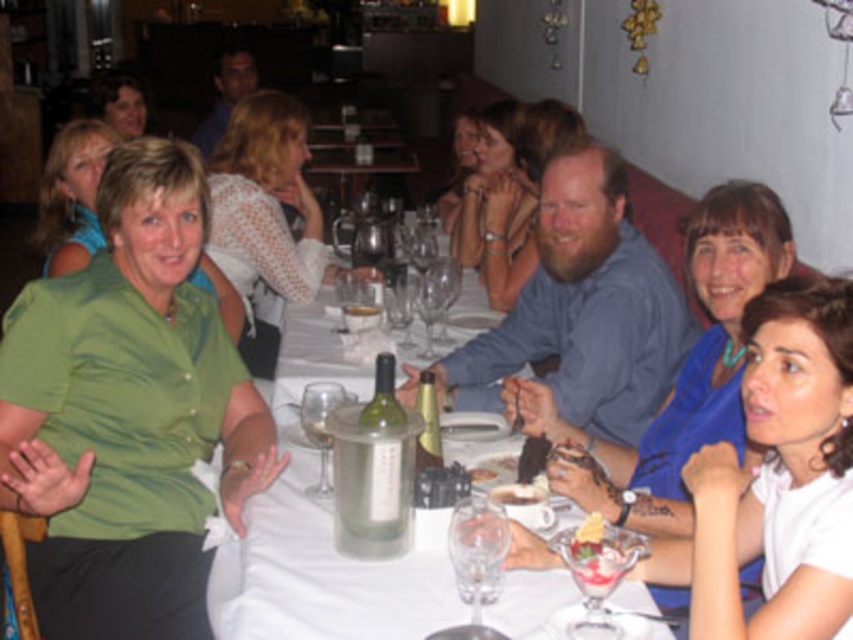
Question: Can you confirm if transparent glass at center is positioned below matte black hair at upper left?

Choices:
 (A) no
 (B) yes

Answer: (B)

Question: Which of the following is the farthest from the observer?

Choices:
 (A) smooth chocolate cake at center
 (B) transparent glass at center
 (C) clear glass wine glass at center

Answer: (A)

Question: Can you confirm if clear glass wine glass at lower center is bigger than transparent glass at center?

Choices:
 (A) yes
 (B) no

Answer: (A)

Question: Estimate the real-world distances between objects in this image. Which object is closer to the white matte shirt at lower right?

Choices:
 (A) smooth chocolate cake at center
 (B) white glossy table at center

Answer: (B)

Question: Can you confirm if white matte shirt at lower right is bigger than clear glass wine glass at lower center?

Choices:
 (A) yes
 (B) no

Answer: (A)

Question: Based on their relative distances, which object is farther from the smooth chocolate cake at center?

Choices:
 (A) white glossy table at center
 (B) translucent glass wine at center
 (C) clear glass wine glass at center

Answer: (B)